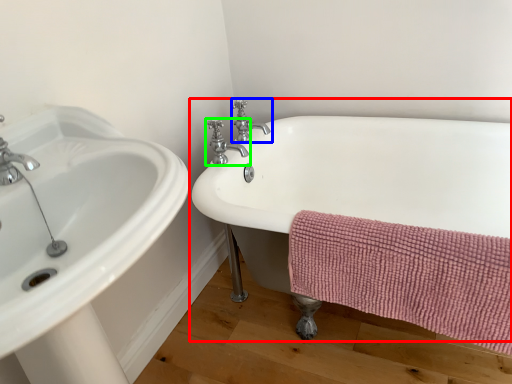
Question: Which object is positioned closest to bathtub (highlighted by a red box)? Select from tap (highlighted by a blue box) and tap (highlighted by a green box).

Choices:
 (A) tap
 (B) tap

Answer: (B)